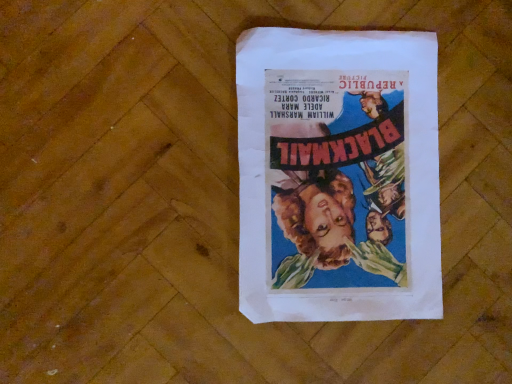
This screenshot has width=512, height=384. I want to click on empty space that is ontop of vintage paper poster at center (from a real-world perspective), so click(x=346, y=175).